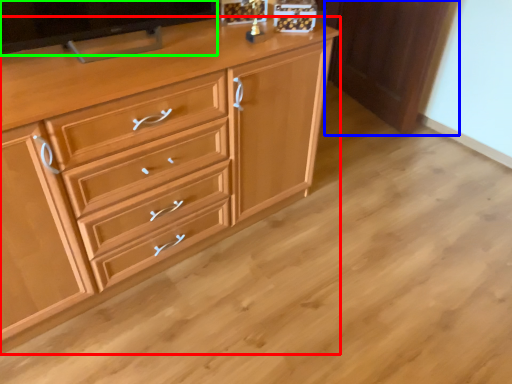
Question: Based on their relative distances, which object is nearer to chest of drawers (highlighted by a red box)? Choose from cabinetry (highlighted by a blue box) and television (highlighted by a green box).

Choices:
 (A) cabinetry
 (B) television

Answer: (B)